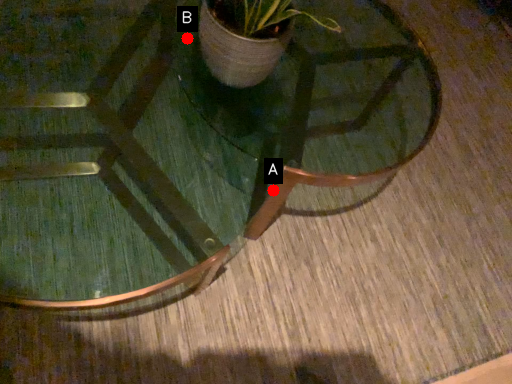
Question: Two points are circled on the image, labeled by A and B beside each circle. Among these points, which one is farthest from the camera?

Choices:
 (A) A is further
 (B) B is further

Answer: (B)